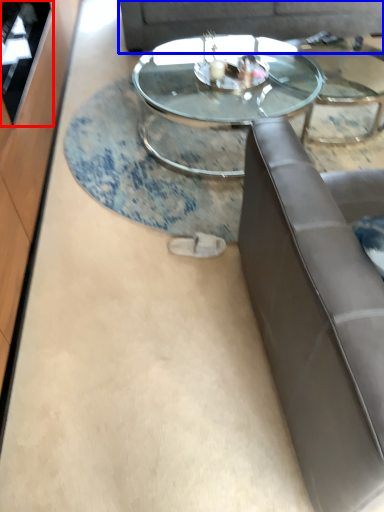
Question: Which object appears closest to the camera in this image, glass door (highlighted by a red box) or couch (highlighted by a blue box)?

Choices:
 (A) glass door
 (B) couch

Answer: (A)